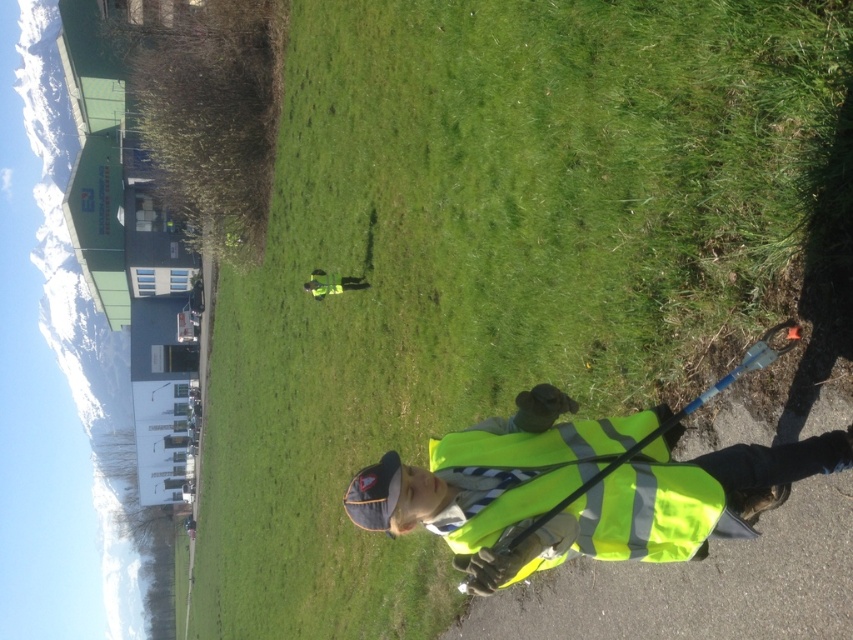
In the scene shown: You are standing at the point labeled point (541, 458) and want to walk towards the point labeled point (308, 285). Will you be moving towards the background or the foreground of the image?

Since point (541, 458) is in front of point (308, 285), moving from point (541, 458) towards point (308, 285) means you are moving towards the background of the image.